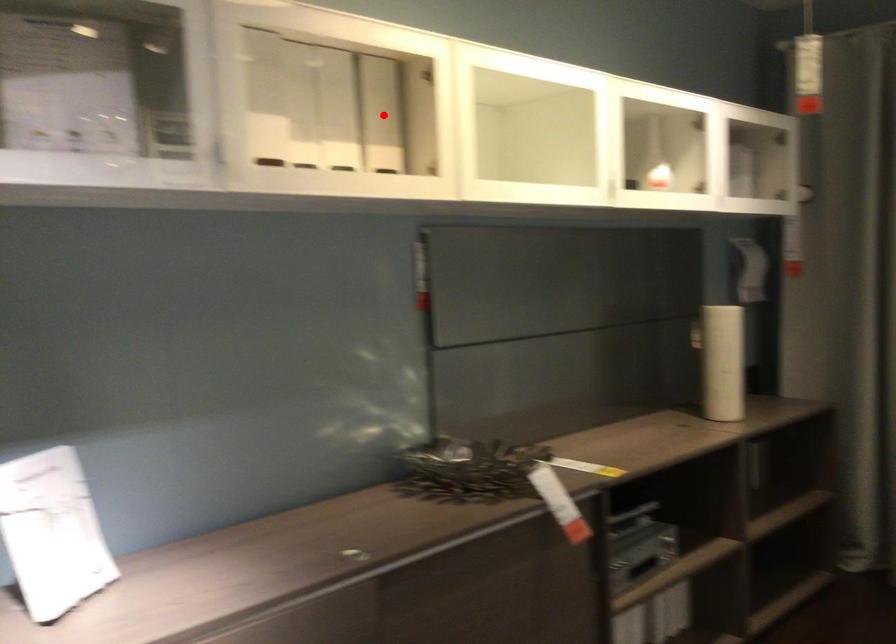
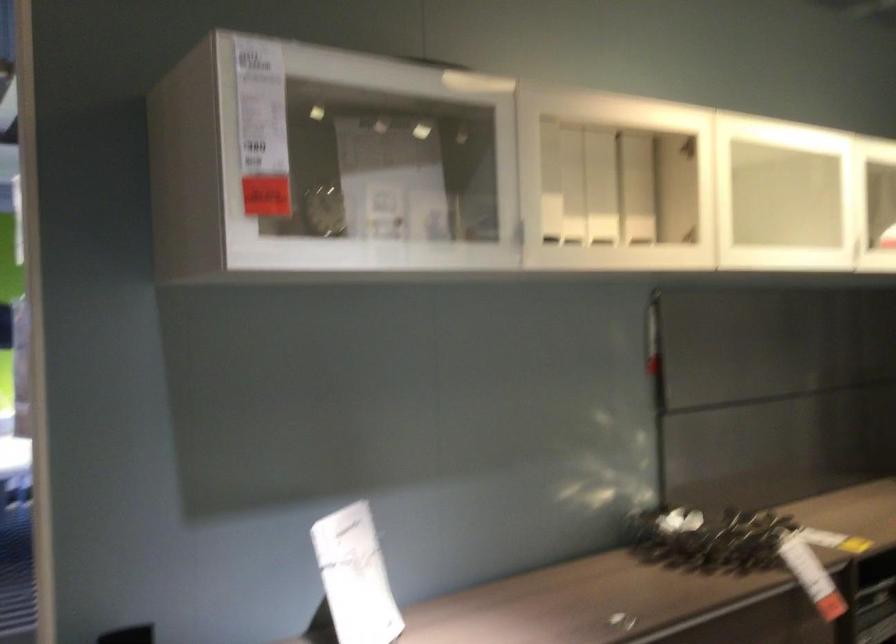
The point at the highlighted location is marked in the first image. Where is the corresponding point in the second image?

(636, 187)